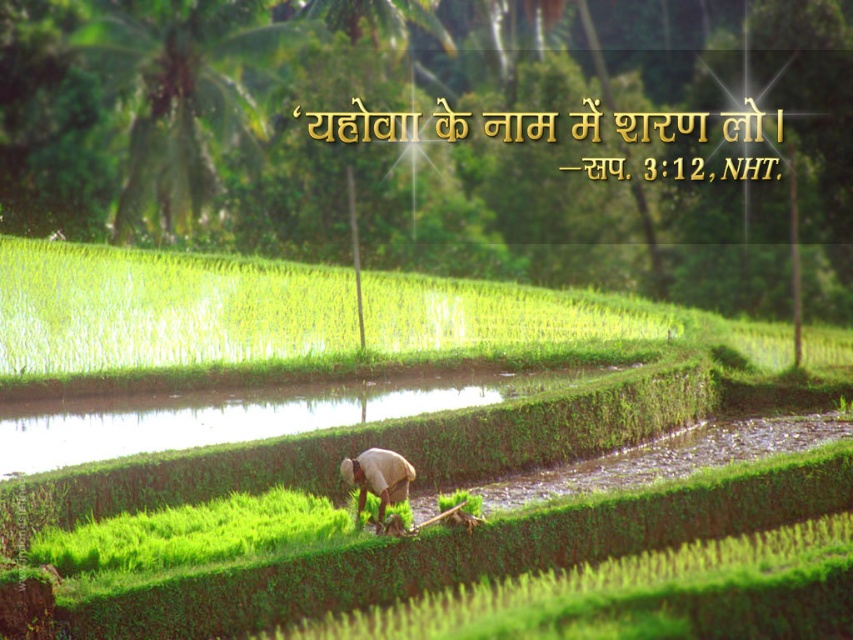
Question: Does green grass at center have a greater width compared to light brown fabric at center?

Choices:
 (A) yes
 (B) no

Answer: (A)

Question: Among these objects, which one is farthest from the camera?

Choices:
 (A) green grass at center
 (B) light brown fabric at center

Answer: (B)

Question: Which object is farther from the camera taking this photo?

Choices:
 (A) green grass at center
 (B) light brown fabric at center

Answer: (B)

Question: Can you confirm if green grass at center is smaller than light brown fabric at center?

Choices:
 (A) yes
 (B) no

Answer: (B)

Question: Can you confirm if green grass at center is wider than light brown fabric at center?

Choices:
 (A) no
 (B) yes

Answer: (B)